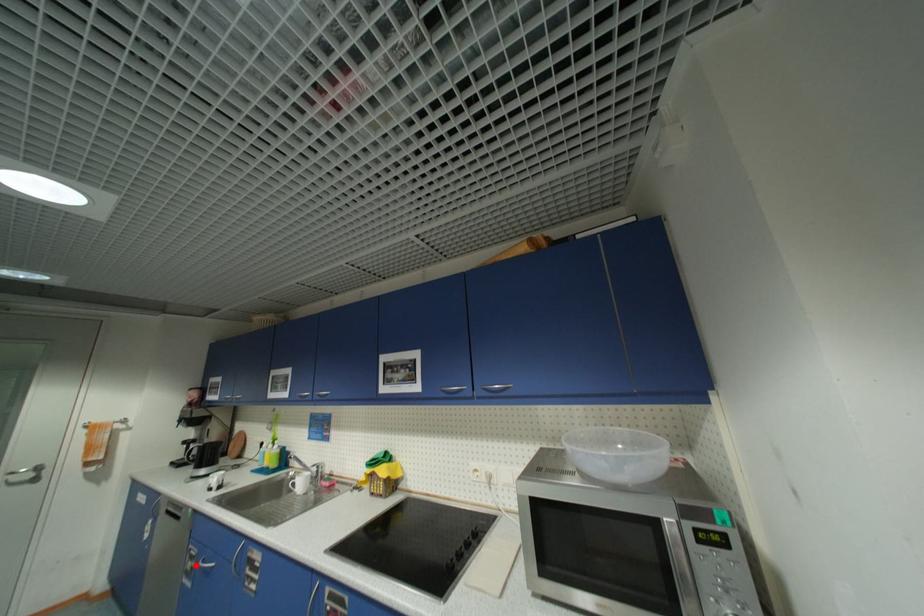
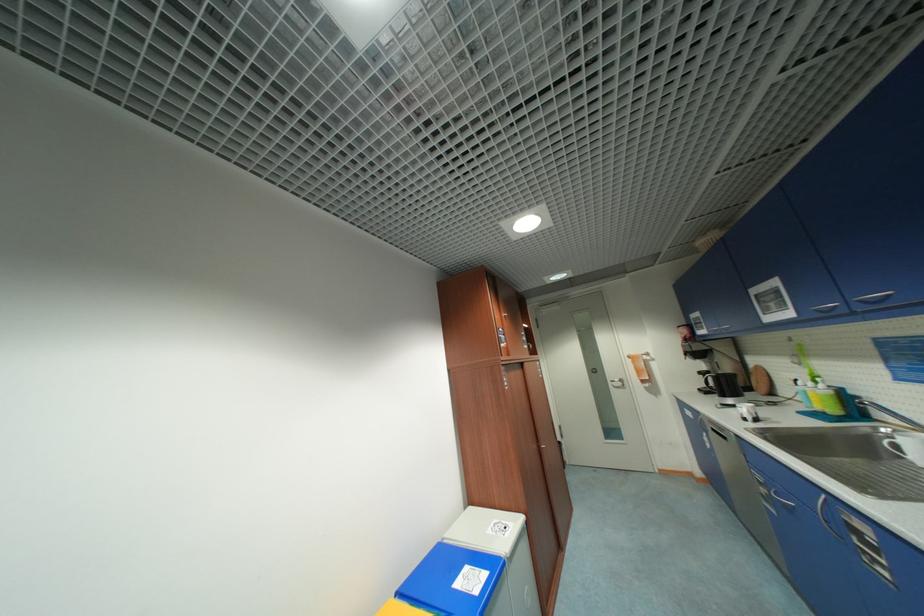
Find the pixel in the second image that matches the highlighted location in the first image.

(768, 491)